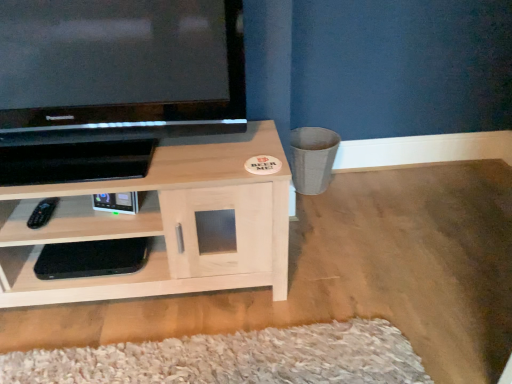
Question: Does light wood/woodenobject at lower left, the 1th shelf from the top, touch black glossy television at upper left?

Choices:
 (A) no
 (B) yes

Answer: (A)

Question: From the image's perspective, would you say light wood/woodenobject at lower left, the second shelf when ordered from bottom to top, is shown under black glossy television at upper left?

Choices:
 (A) no
 (B) yes

Answer: (B)

Question: Does light wood/woodenobject at lower left, the second shelf when ordered from bottom to top, have a larger size compared to black glossy television at upper left?

Choices:
 (A) yes
 (B) no

Answer: (A)

Question: Is light wood/woodenobject at lower left, the 1th shelf from the top, at the left side of black glossy television at upper left?

Choices:
 (A) no
 (B) yes

Answer: (B)

Question: Is light wood/woodenobject at lower left, the 1th shelf from the top, facing towards black glossy television at upper left?

Choices:
 (A) no
 (B) yes

Answer: (A)

Question: From the image's perspective, is black plastic remote at lower left positioned above or below black glossy television at upper left?

Choices:
 (A) below
 (B) above

Answer: (A)

Question: Is black plastic remote at lower left inside the boundaries of black glossy television at upper left, or outside?

Choices:
 (A) outside
 (B) inside

Answer: (A)

Question: Is black plastic remote at lower left to the left or to the right of black glossy television at upper left in the image?

Choices:
 (A) right
 (B) left

Answer: (B)

Question: In terms of width, does black plastic remote at lower left look wider or thinner when compared to black glossy television at upper left?

Choices:
 (A) thin
 (B) wide

Answer: (A)

Question: Considering the positions of point (39, 241) and point (24, 261), is point (39, 241) closer or farther from the camera than point (24, 261)?

Choices:
 (A) closer
 (B) farther

Answer: (A)

Question: From the image's perspective, relative to black matte console at lower left, which ranks as the 2th shelf in top-to-bottom order, is light wood/woodenobject at lower left, the 1th shelf from the top, above or below?

Choices:
 (A) below
 (B) above

Answer: (B)

Question: Looking at the image, does light wood/woodenobject at lower left, the 1th shelf from the top, seem bigger or smaller compared to black matte console at lower left, which ranks as the 2th shelf in top-to-bottom order?

Choices:
 (A) small
 (B) big

Answer: (B)

Question: Considering their positions, is light wood/woodenobject at lower left, the second shelf when ordered from bottom to top, located in front of or behind black matte console at lower left, which ranks as the 2th shelf in top-to-bottom order?

Choices:
 (A) behind
 (B) front

Answer: (B)

Question: Is light wood/woodenobject at lower left, the second shelf when ordered from bottom to top, taller or shorter than black glossy television at upper left?

Choices:
 (A) short
 (B) tall

Answer: (B)

Question: Considering the positions of light wood/woodenobject at lower left, the second shelf when ordered from bottom to top, and black glossy television at upper left in the image, is light wood/woodenobject at lower left, the second shelf when ordered from bottom to top, wider or thinner than black glossy television at upper left?

Choices:
 (A) thin
 (B) wide

Answer: (B)